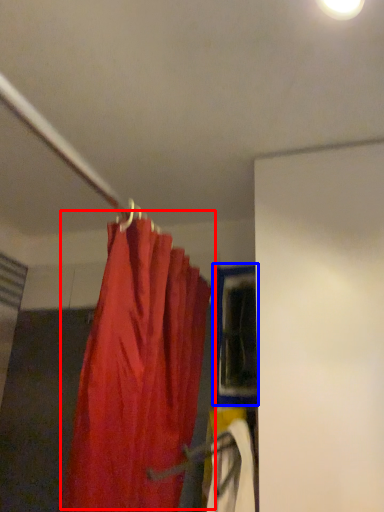
Question: Among these objects, which one is nearest to the camera, curtain (highlighted by a red box) or window (highlighted by a blue box)?

Choices:
 (A) curtain
 (B) window

Answer: (A)